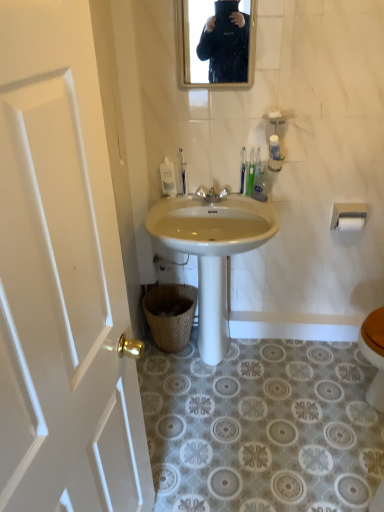
Where is `free location to the left of green plastic toothbrush at upper center, which is the 1th toilet brush from right to left`? free location to the left of green plastic toothbrush at upper center, which is the 1th toilet brush from right to left is located at coordinates (217, 200).